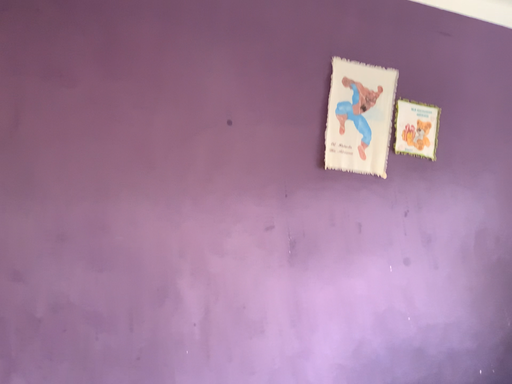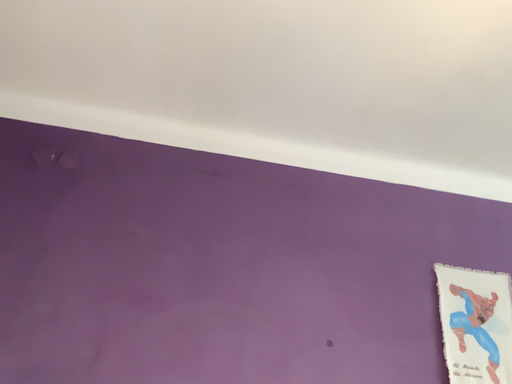
Question: How did the camera likely rotate when shooting the video?

Choices:
 (A) rotated right
 (B) rotated left

Answer: (B)